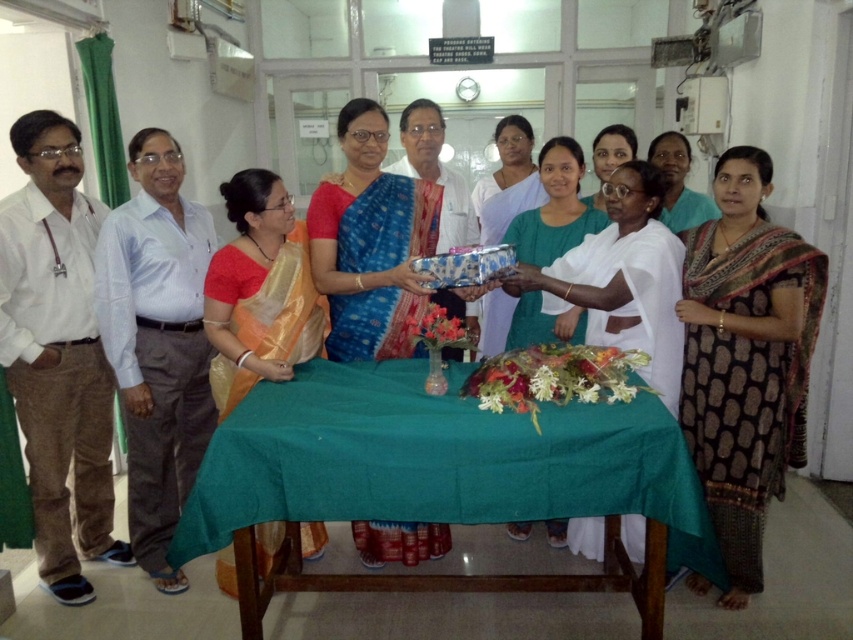
Between light blue shirt at center and orange silk saree at center, which one is positioned higher?

orange silk saree at center is higher up.

Where is `light blue shirt at center`? light blue shirt at center is located at coordinates (157, 342).

Can you confirm if green fabric-covered table at center is positioned to the left of shiny silver bowl at center?

Correct, you'll find green fabric-covered table at center to the left of shiny silver bowl at center.

Between point (616, 584) and point (492, 243), which one is positioned behind?

Positioned behind is point (492, 243).

Does point (229, 451) come behind point (509, 170)?

No.

Locate an element on the screen. This screenshot has height=640, width=853. green fabric-covered table at center is located at coordinates (440, 477).

Between light blue shirt at center and matte white saree at center, which one appears on the right side from the viewer's perspective?

matte white saree at center is more to the right.

Who is more distant from viewer, (166, 432) or (682, 216)?

The point (682, 216) is more distant.

Is point (206, 355) closer to viewer compared to point (672, 204)?

Yes.

At what (x,y) coordinates should I click in order to perform the action: click on light blue shirt at center. Please return your answer as a coordinate pair (x, y). This screenshot has width=853, height=640. Looking at the image, I should click on (157, 342).